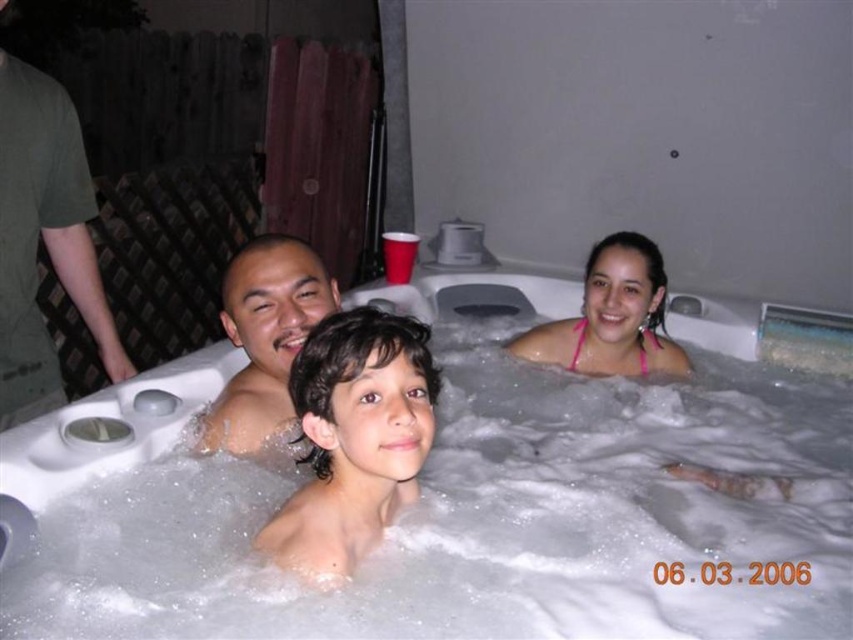
Between dark brown hair at center and smooth skin man at center, which one appears on the left side from the viewer's perspective?

smooth skin man at center

Who is lower down, dark brown hair at center or smooth skin man at center?

dark brown hair at center is below.

Between point (279, 544) and point (276, 424), which one is positioned in front?

Point (279, 544) is in front.

Find the location of a particular element. This screenshot has width=853, height=640. dark brown hair at center is located at coordinates (354, 438).

Between white bubbly foam at center and dark brown hair at center, which one appears on the right side from the viewer's perspective?

white bubbly foam at center

Does white bubbly foam at center have a larger size compared to dark brown hair at center?

Indeed, white bubbly foam at center has a larger size compared to dark brown hair at center.

Which is in front, point (636, 403) or point (373, 484)?

Point (373, 484) is in front.

You are a GUI agent. You are given a task and a screenshot of the screen. Output one action in this format:
    pyautogui.click(x=<x>, y=<y>)
    Task: Click on the white bubbly foam at center
    The height and width of the screenshot is (640, 853).
    Given the screenshot: What is the action you would take?
    pyautogui.click(x=454, y=513)

Can you confirm if white bubbly foam at center is positioned to the right of smooth skin man at center?

Correct, you'll find white bubbly foam at center to the right of smooth skin man at center.

Which is below, white bubbly foam at center or smooth skin man at center?

white bubbly foam at center is lower down.

This screenshot has width=853, height=640. Describe the element at coordinates (454, 513) in the screenshot. I see `white bubbly foam at center` at that location.

The width and height of the screenshot is (853, 640). What are the coordinates of `white bubbly foam at center` in the screenshot? It's located at (454, 513).